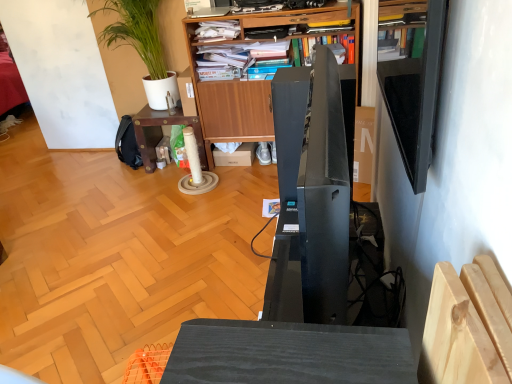
Question: Is wooden table at center thinner than black glossy speaker at center?

Choices:
 (A) yes
 (B) no

Answer: (B)

Question: From a real-world perspective, is wooden table at center beneath black glossy speaker at center?

Choices:
 (A) yes
 (B) no

Answer: (A)

Question: Would you consider wooden table at center to be distant from black glossy speaker at center?

Choices:
 (A) no
 (B) yes

Answer: (B)

Question: From a real-world perspective, is wooden table at center over black glossy speaker at center?

Choices:
 (A) no
 (B) yes

Answer: (A)

Question: Is the position of wooden table at center more distant than that of black glossy speaker at center?

Choices:
 (A) yes
 (B) no

Answer: (A)

Question: Considering their positions, is wooden table at center located in front of or behind black glossy shelf at upper right?

Choices:
 (A) behind
 (B) front

Answer: (A)

Question: Considering the relative positions of wooden table at center and black glossy shelf at upper right in the image provided, is wooden table at center to the left or to the right of black glossy shelf at upper right?

Choices:
 (A) left
 (B) right

Answer: (A)

Question: Is wooden table at center bigger or smaller than black glossy shelf at upper right?

Choices:
 (A) big
 (B) small

Answer: (A)

Question: Is point (152, 157) closer or farther from the camera than point (417, 153)?

Choices:
 (A) farther
 (B) closer

Answer: (A)

Question: Does point (284, 311) appear closer or farther from the camera than point (406, 157)?

Choices:
 (A) farther
 (B) closer

Answer: (A)

Question: Is black glossy speaker at center in front of or behind black glossy shelf at upper right in the image?

Choices:
 (A) behind
 (B) front

Answer: (B)

Question: Is black glossy speaker at center bigger or smaller than black glossy shelf at upper right?

Choices:
 (A) small
 (B) big

Answer: (B)

Question: Is black glossy speaker at center situated inside black glossy shelf at upper right or outside?

Choices:
 (A) inside
 (B) outside

Answer: (B)

Question: In terms of width, does black glossy shelf at upper right look wider or thinner when compared to green leafy plant at upper left?

Choices:
 (A) thin
 (B) wide

Answer: (A)

Question: Is black glossy shelf at upper right spatially inside green leafy plant at upper left, or outside of it?

Choices:
 (A) outside
 (B) inside

Answer: (A)